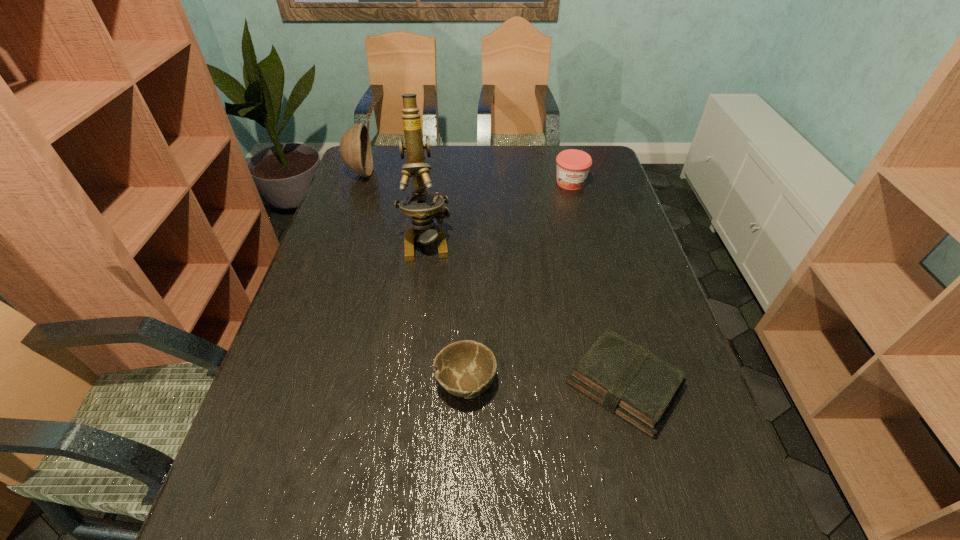
The width and height of the screenshot is (960, 540). I want to click on free space located 0.250m on the front label of the third shortest object, so click(x=586, y=241).

In order to click on vacant area located 0.070m on the left of the shorter bowl in this screenshot , I will do point(403,383).

At what (x,y) coordinates should I click in order to perform the action: click on vacant space located on the left of the shortest object. Please return your answer as a coordinate pair (x, y). Looking at the image, I should click on (414, 384).

In order to click on bowl at the far edge in this screenshot , I will do `click(355, 148)`.

Where is `jam located at the far edge`? This screenshot has height=540, width=960. jam located at the far edge is located at coordinates (573, 165).

I want to click on object that is positioned at the left edge, so click(x=355, y=148).

Where is `jam present at the right edge`? This screenshot has width=960, height=540. jam present at the right edge is located at coordinates (573, 165).

Locate an element on the screen. The image size is (960, 540). book at the right edge is located at coordinates (625, 378).

Identify the location of object that is at the far left corner. This screenshot has width=960, height=540. (355, 148).

Locate an element on the screen. object that is at the far right corner is located at coordinates (573, 165).